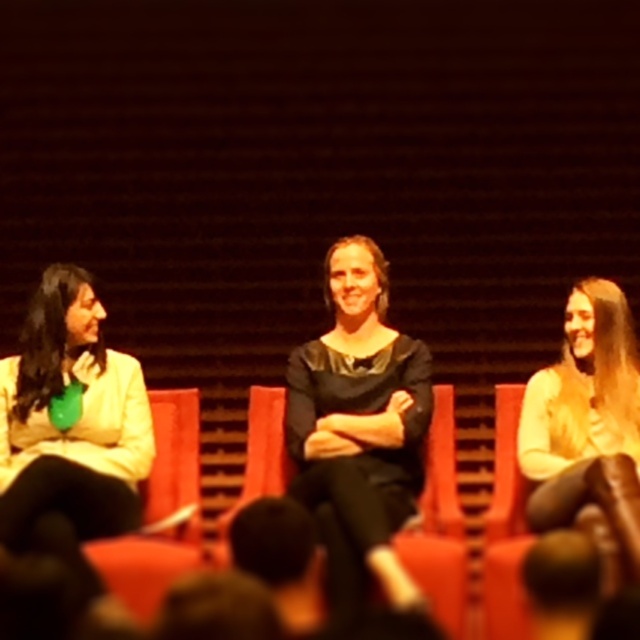
You are standing in front of the panel discussion stage and want to determine which of the two points, point (342,412) or point (460,592), is closer to you. Based on the image, which point is nearer?

Point (342,412) is further to the viewer than point (460,592). Wait, no, the description says the first point is further to the viewer, meaning it is closer to the viewer. So the answer is point (342,412) is closer.

You are a photographer adjusting the lighting for a panel discussion. The scene has three people sitting on red chairs. You need to ensure the matte yellow jacket at left is properly lit. Where should you position the light relative to the point marked at coordinates point (70, 417)?

The point (70, 417) marks the matte yellow jacket at left, so you should position the light to the left of this point to ensure proper illumination of the jacket.

You are a photographer setting up for a panel discussion. You need to place two lights to illuminate the matte yellow jacket at left and the light beige sweater at center. The minimum distance required between each light and the subject is 1.5 meters. Can both subjects be lit adequately without violating the distance requirement?

The matte yellow jacket at left is 2.44 meters away from light beige sweater at center. Since the minimum distance required between each light and the subject is 1.5 meters, both subjects can be lit adequately as the distance between them allows placing each light at least 1.5 meters away from their respective subjects.